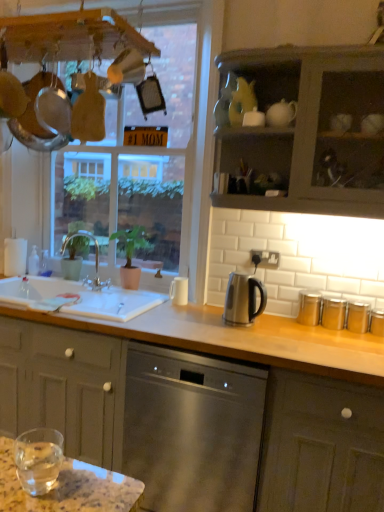
Describe the element at coordinates (95, 259) in the screenshot. Image resolution: width=384 pixels, height=512 pixels. I see `brushed metal faucet at sink left` at that location.

What do you see at coordinates (179, 291) in the screenshot? I see `white matte cup at center` at bounding box center [179, 291].

Where is `clear glass window at upper center`? clear glass window at upper center is located at coordinates (162, 159).

The width and height of the screenshot is (384, 512). Find the location of `matte gray cabinet at upper right, acting as the second cabinetry starting from the bottom`. matte gray cabinet at upper right, acting as the second cabinetry starting from the bottom is located at coordinates (311, 129).

Locate an element on the screen. brushed metal faucet at sink left is located at coordinates coord(95,259).

How distant is stainless steel dishwasher at center from clear glass window at upper center?

stainless steel dishwasher at center and clear glass window at upper center are 37.21 inches apart from each other.

Looking at this image, is stainless steel dishwasher at center with clear glass window at upper center?

No, stainless steel dishwasher at center is not making contact with clear glass window at upper center.

Does stainless steel dishwasher at center turn towards clear glass window at upper center?

No, stainless steel dishwasher at center is not facing towards clear glass window at upper center.

Considering the relative sizes of stainless steel dishwasher at center and clear glass window at upper center in the image provided, is stainless steel dishwasher at center shorter than clear glass window at upper center?

Indeed, stainless steel dishwasher at center has a lesser height compared to clear glass window at upper center.

Consider the image. Is the surface of clear glass water at lower left in direct contact with stainless steel dishwasher at center?

No.

Considering the relative positions of clear glass water at lower left and stainless steel dishwasher at center in the image provided, is clear glass water at lower left to the left of stainless steel dishwasher at center from the viewer's perspective?

Correct, you'll find clear glass water at lower left to the left of stainless steel dishwasher at center.

Between point (34, 478) and point (162, 450), which one is positioned behind?

Positioned behind is point (162, 450).

Can you confirm if clear glass water at lower left is thinner than stainless steel dishwasher at center?

Correct, the width of clear glass water at lower left is less than that of stainless steel dishwasher at center.

From a real-world perspective, between satin silver kettle at center and matte gray cabinet at upper right, acting as the second cabinetry starting from the bottom, who is vertically higher?

matte gray cabinet at upper right, acting as the second cabinetry starting from the bottom, is physically above.

Looking at this image, is satin silver kettle at center taller than matte gray cabinet at upper right, the 1th cabinetry positioned from the top?

No, satin silver kettle at center is not taller than matte gray cabinet at upper right, the 1th cabinetry positioned from the top.

How different are the orientations of satin silver kettle at center and matte gray cabinet at upper right, the 1th cabinetry positioned from the top, in degrees?

The angular difference between satin silver kettle at center and matte gray cabinet at upper right, the 1th cabinetry positioned from the top, is 7.6 degrees.

Between point (258, 310) and point (351, 95), which one is positioned in front?

The point (351, 95) is closer.

Locate an element on the screen. The height and width of the screenshot is (512, 384). window that appears on the left of satin silver kettle at center is located at coordinates (162, 159).

Looking at this image, from a real-world perspective, is clear glass window at upper center below satin silver kettle at center?

Actually, clear glass window at upper center is physically above satin silver kettle at center in the real world.

Is clear glass water at lower left looking in the opposite direction of matte gray cabinet at lower right, marked as the 2th cabinetry in a top-to-bottom arrangement?

That's not correct — clear glass water at lower left is not looking away from matte gray cabinet at lower right, marked as the 2th cabinetry in a top-to-bottom arrangement.

Can you tell me how much clear glass water at lower left and matte gray cabinet at lower right, marked as the 2th cabinetry in a top-to-bottom arrangement, differ in facing direction?

The angular difference between clear glass water at lower left and matte gray cabinet at lower right, marked as the 2th cabinetry in a top-to-bottom arrangement, is 178 degrees.

From a real-world perspective, does clear glass water at lower left sit lower than matte gray cabinet at lower right, marked as the 2th cabinetry in a top-to-bottom arrangement?

Incorrect, from a real-world perspective, clear glass water at lower left is higher than matte gray cabinet at lower right, marked as the 2th cabinetry in a top-to-bottom arrangement.

From the image's perspective, who appears lower, clear glass water at lower left or matte gray cabinet at lower right, the first cabinetry from the bottom?

matte gray cabinet at lower right, the first cabinetry from the bottom.

Visually, is white matte cup at center positioned to the left or to the right of stainless steel dishwasher at center?

In the image, white matte cup at center appears on the left side of stainless steel dishwasher at center.

How different are the orientations of white matte cup at center and stainless steel dishwasher at center in degrees?

They differ by 0.878 degrees in their facing directions.

Is white matte cup at center wider or thinner than stainless steel dishwasher at center?

In the image, white matte cup at center appears to be more narrow than stainless steel dishwasher at center.

From a real-world perspective, is white matte cup at center below stainless steel dishwasher at center?

No.

Does point (92, 234) lie in front of point (31, 478)?

No, (92, 234) is further to viewer.

From a real-world perspective, is brushed metal faucet at sink left below clear glass water at lower left?

No, from a real-world perspective, brushed metal faucet at sink left is not beneath clear glass water at lower left.

Which of these two, brushed metal faucet at sink left or clear glass water at lower left, stands taller?

With more height is brushed metal faucet at sink left.

At what (x,y) coordinates should I click in order to perform the action: click on window above the stainless steel dishwasher at center (from a real-world perspective). Please return your answer as a coordinate pair (x, y). This screenshot has width=384, height=512. Looking at the image, I should click on (162, 159).

The width and height of the screenshot is (384, 512). What are the coordinates of `dishwasher that appears on the right of clear glass water at lower left` in the screenshot? It's located at (191, 429).

Which object lies nearer to the anchor point clear glass water at lower left, matte gray cabinet at lower right, the first cabinetry from the bottom, or clear glass window at upper center?

matte gray cabinet at lower right, the first cabinetry from the bottom, lies closer to clear glass water at lower left than the other object.

Based on their spatial positions, is matte gray cabinet at lower right, marked as the 2th cabinetry in a top-to-bottom arrangement, or stainless steel dishwasher at center further from clear glass water at lower left?

matte gray cabinet at lower right, marked as the 2th cabinetry in a top-to-bottom arrangement, lies further to clear glass water at lower left than the other object.

Looking at the image, which one is located closer to green matte plant at center, clear glass water at lower left or matte gray cabinet at lower right, the first cabinetry from the bottom?

Based on the image, matte gray cabinet at lower right, the first cabinetry from the bottom, appears to be nearer to green matte plant at center.

Which object lies nearer to the anchor point matte gray cabinet at upper right, acting as the second cabinetry starting from the bottom, satin silver kettle at center or matte gray cabinet at lower right, the first cabinetry from the bottom?

satin silver kettle at center.

Considering their positions, is clear glass water at lower left positioned further to matte gray cabinet at upper right, acting as the second cabinetry starting from the bottom, than clear glass window at upper center?

Based on the image, clear glass water at lower left appears to be further to matte gray cabinet at upper right, acting as the second cabinetry starting from the bottom.

Which object lies nearer to the anchor point green matte plant at center, clear glass water at lower left or brushed metal faucet at sink left?

Based on the image, brushed metal faucet at sink left appears to be nearer to green matte plant at center.

Based on their spatial positions, is white matte cup at center or stainless steel dishwasher at center further from green matte plant at center?

The object further to green matte plant at center is stainless steel dishwasher at center.

Based on the photo, which object lies further to the anchor point stainless steel dishwasher at center, matte gray cabinet at upper right, acting as the second cabinetry starting from the bottom, or green matte plant at center?

Based on the image, green matte plant at center appears to be further to stainless steel dishwasher at center.

The image size is (384, 512). What are the coordinates of `dishwasher located between clear glass water at lower left and matte gray cabinet at lower right, the first cabinetry from the bottom, in the left-right direction` in the screenshot? It's located at (191, 429).

Identify the location of kitchen appliance between brushed metal faucet at sink left and matte gray cabinet at upper right, the 1th cabinetry positioned from the top, from left to right. Image resolution: width=384 pixels, height=512 pixels. (243, 298).

The width and height of the screenshot is (384, 512). I want to click on kitchen appliance between clear glass water at lower left and green matte plant at center in the front-back direction, so click(243, 298).

Locate an element on the screen. kitchen appliance located between matte gray cabinet at lower right, the first cabinetry from the bottom, and white matte cup at center in the depth direction is located at coordinates (243, 298).